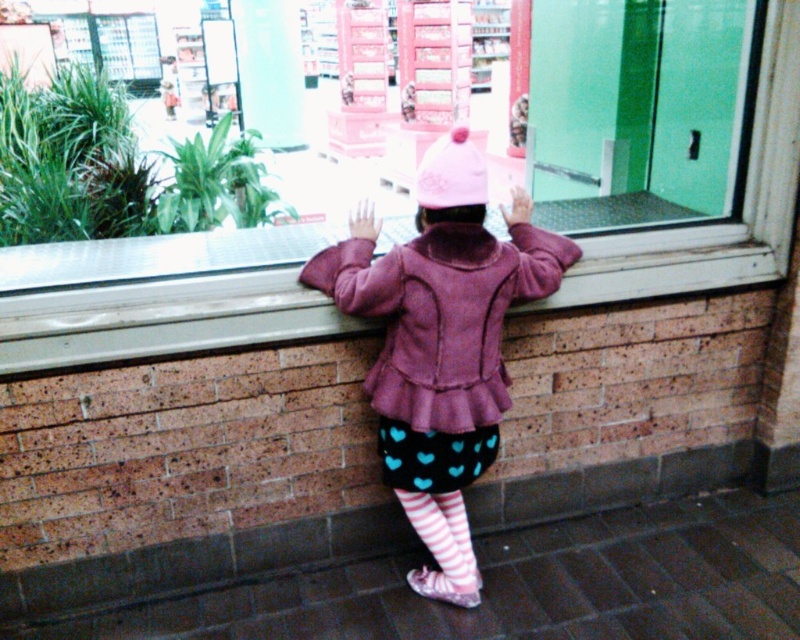
You are a delivery robot positioned at point (x=478, y=156). You need to deliver a package to point (x=784, y=140). However, there is an obstacle in your path. Based on the scene description, can you determine if the obstacle is between your current position and the destination?

Point (x=784, y=140) is behind point (x=478, y=156), so the obstacle is between your current position and the destination.

The child is standing at a window in a store or public space. The child is wearing a pink winter hat, a pink jacket with a ruffled hem, a black skirt with blue heart patterns, striped tights, and pink shoes. Their hands are on the windowsill, and their back is to the camera. There is a point marked at coordinates (440,358). What is located at that point?

At point (440,358) lies the pink fleece jacket at center.